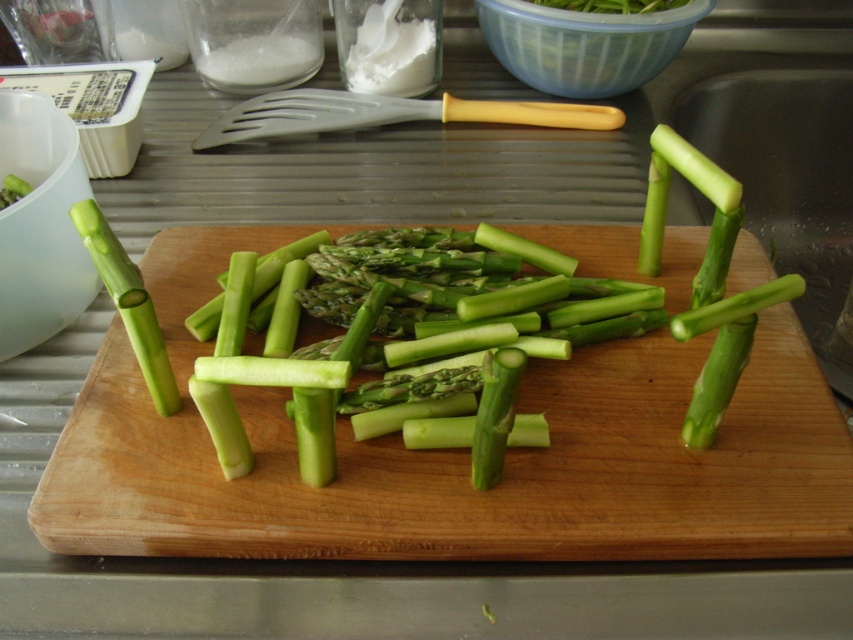
Is green smooth asparagus at center wider than green matte asparagus at left?

Yes, green smooth asparagus at center is wider than green matte asparagus at left.

Is green smooth asparagus at center positioned behind green matte asparagus at left?

No, it is in front of green matte asparagus at left.

Where is `green smooth asparagus at center`? The width and height of the screenshot is (853, 640). green smooth asparagus at center is located at coordinates (412, 300).

Who is more forward, (x=785, y=480) or (x=474, y=298)?

Point (x=785, y=480) is more forward.

Can you confirm if green wood cutting board at center is positioned to the left of green smooth asparagus at center?

Incorrect, green wood cutting board at center is not on the left side of green smooth asparagus at center.

Which is behind, point (218, 548) or point (358, 296)?

Point (358, 296)

Where is `green wood cutting board at center`? The width and height of the screenshot is (853, 640). green wood cutting board at center is located at coordinates (454, 456).

Who is lower down, green wood cutting board at center or green matte asparagus at left?

green wood cutting board at center is below.

Between green wood cutting board at center and green matte asparagus at left, which one appears on the right side from the viewer's perspective?

From the viewer's perspective, green wood cutting board at center appears more on the right side.

Who is more forward, [223,262] or [99,273]?

Positioned in front is point [99,273].

Where is `green wood cutting board at center`? The width and height of the screenshot is (853, 640). green wood cutting board at center is located at coordinates (454, 456).